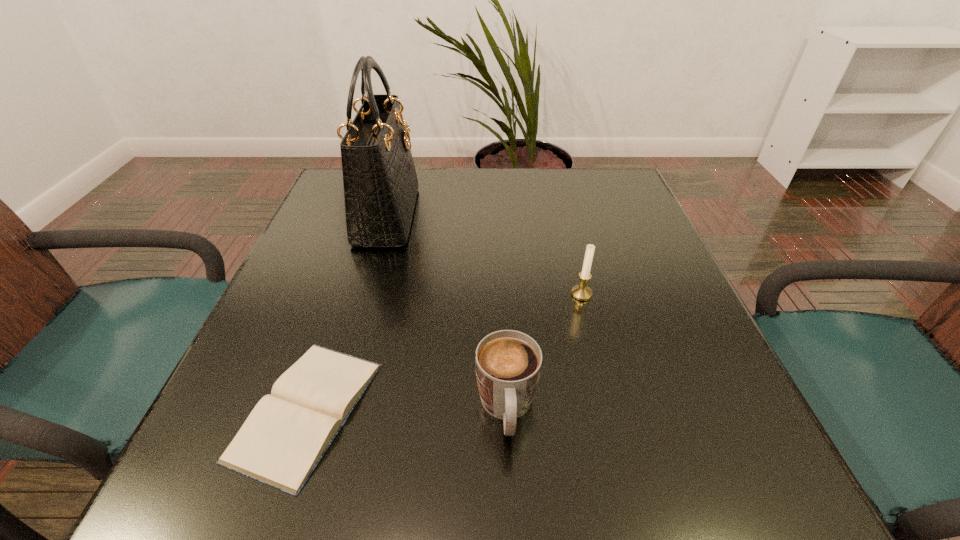
Where is `the farthest object`? the farthest object is located at coordinates pyautogui.click(x=380, y=183).

I want to click on the tallest object, so click(380, 183).

This screenshot has height=540, width=960. In order to click on the rightmost object in this screenshot , I will do `click(581, 292)`.

At what (x,y) coordinates should I click in order to perform the action: click on candle holder. Please return your answer as a coordinate pair (x, y). Image resolution: width=960 pixels, height=540 pixels. Looking at the image, I should click on (581, 292).

At what (x,y) coordinates should I click in order to perform the action: click on the third tallest object. Please return your answer as a coordinate pair (x, y). This screenshot has height=540, width=960. Looking at the image, I should click on (508, 363).

Where is `the second object from right to left`? the second object from right to left is located at coordinates (508, 363).

You are a GUI agent. You are given a task and a screenshot of the screen. Output one action in this format:
    pyautogui.click(x=<x>, y=<y>)
    Task: Click on the shortest object
    This screenshot has height=540, width=960.
    Given the screenshot: What is the action you would take?
    pyautogui.click(x=283, y=439)

This screenshot has width=960, height=540. I want to click on vacant space located at the front of the tallest object with visible charms, so click(x=492, y=215).

At what (x,y) coordinates should I click in order to perform the action: click on free region located 0.060m on the front of the third nearest object. Please return your answer as a coordinate pair (x, y). This screenshot has height=540, width=960. Looking at the image, I should click on (589, 325).

In order to click on free spot located 0.240m on the right of the shortest object in this screenshot , I will do `click(530, 410)`.